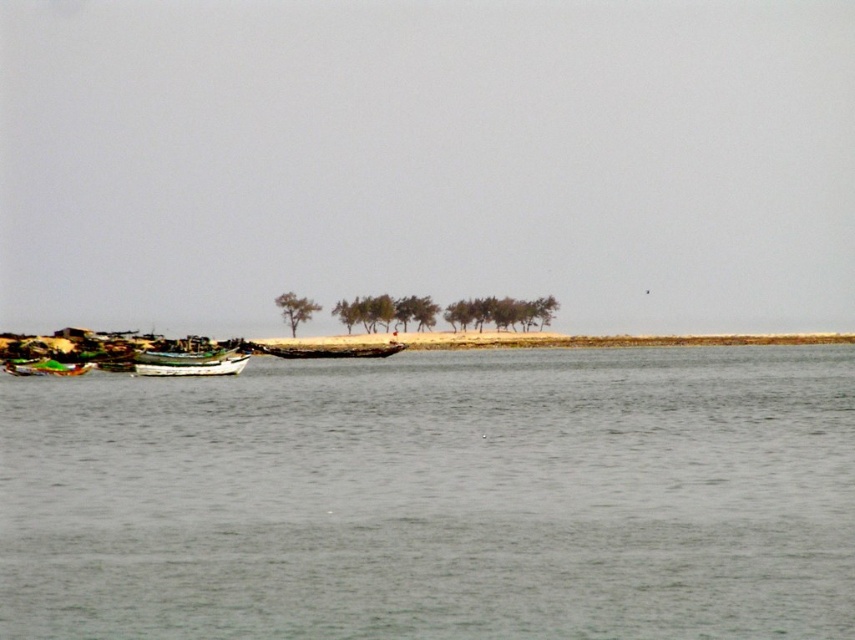
Which of these two, green painted wooden boat at center or green matte tree at center, stands shorter?

With less height is green painted wooden boat at center.

Is green painted wooden boat at center further to the viewer compared to green matte tree at center?

No, green painted wooden boat at center is closer to the viewer.

Find the location of a particular element. This screenshot has height=640, width=855. green painted wooden boat at center is located at coordinates (190, 364).

Which is in front, point (404, 348) or point (282, 310)?

Point (404, 348) is in front.

Does point (293, 355) come behind point (298, 321)?

No, (293, 355) is in front of (298, 321).

Identify the location of wooden boat at center. pyautogui.click(x=327, y=349).

Is clear water at center below green plastic boat at left?

Yes, clear water at center is below green plastic boat at left.

Where is `clear water at center`? clear water at center is located at coordinates (435, 497).